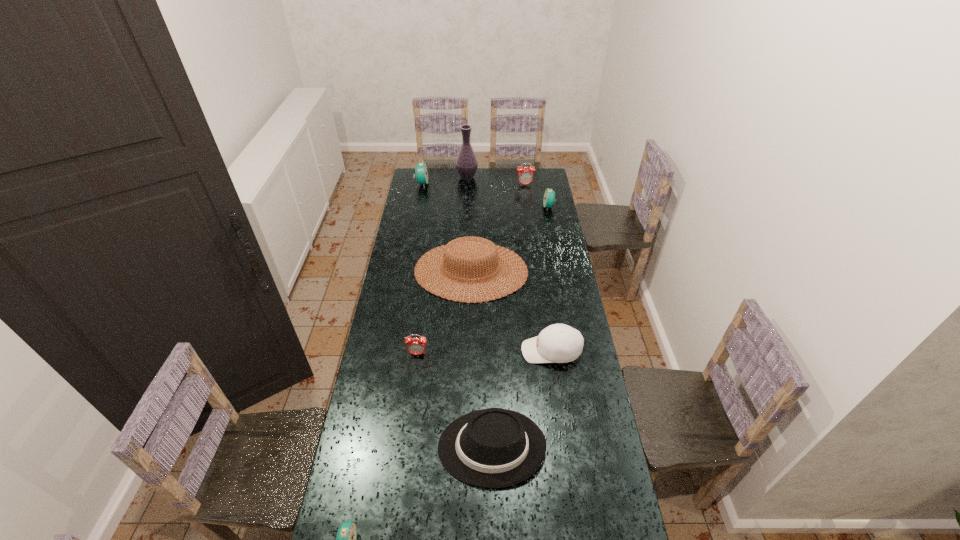
The width and height of the screenshot is (960, 540). In order to click on free region located 0.220m on the front-facing side of the baseball cap in this screenshot , I will do `click(468, 351)`.

The image size is (960, 540). I want to click on vacant space located on the front-facing side of the baseball cap, so click(450, 351).

Find the location of a particular element. vacant area situated on the front-facing side of the second biggest blue alarm clock is located at coordinates (510, 207).

In order to click on free space located on the front-facing side of the second biggest blue alarm clock in this screenshot , I will do `click(510, 207)`.

At what (x,y) coordinates should I click in order to perform the action: click on free location located on the front-facing side of the second biggest blue alarm clock. Please return your answer as a coordinate pair (x, y). Looking at the image, I should click on (498, 207).

I want to click on blank space located 0.400m on the face of the third alarm clock from left to right, so click(x=405, y=454).

Identify the location of vase positioned at the far edge. (466, 163).

Locate an element on the screen. Image resolution: width=960 pixels, height=540 pixels. sunhat that is positioned at the left edge is located at coordinates (454, 248).

At what (x,y) coordinates should I click in order to perform the action: click on baseball cap at the right edge. Please return your answer as a coordinate pair (x, y). Image resolution: width=960 pixels, height=540 pixels. Looking at the image, I should click on (558, 343).

Locate an element on the screen. This screenshot has height=540, width=960. object that is at the far left corner is located at coordinates (421, 171).